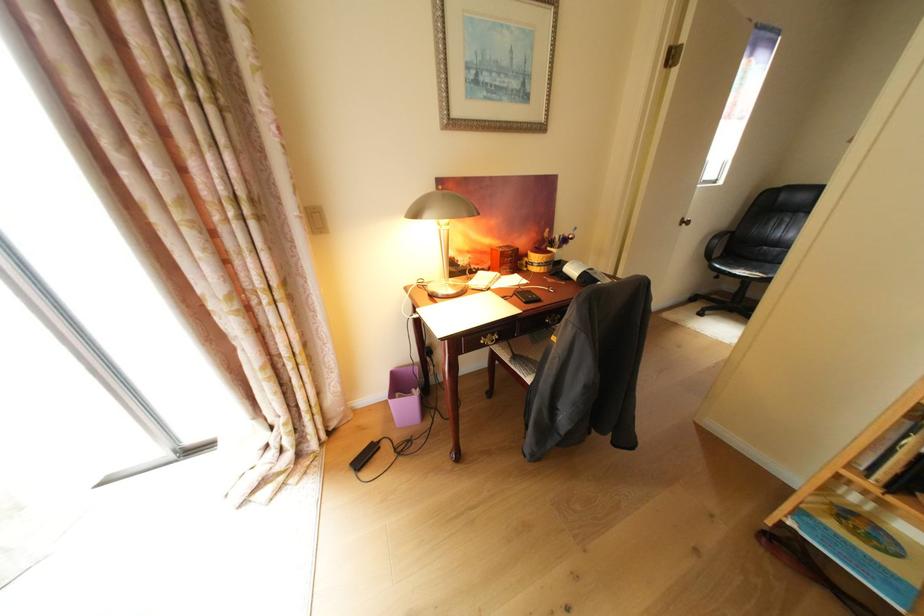
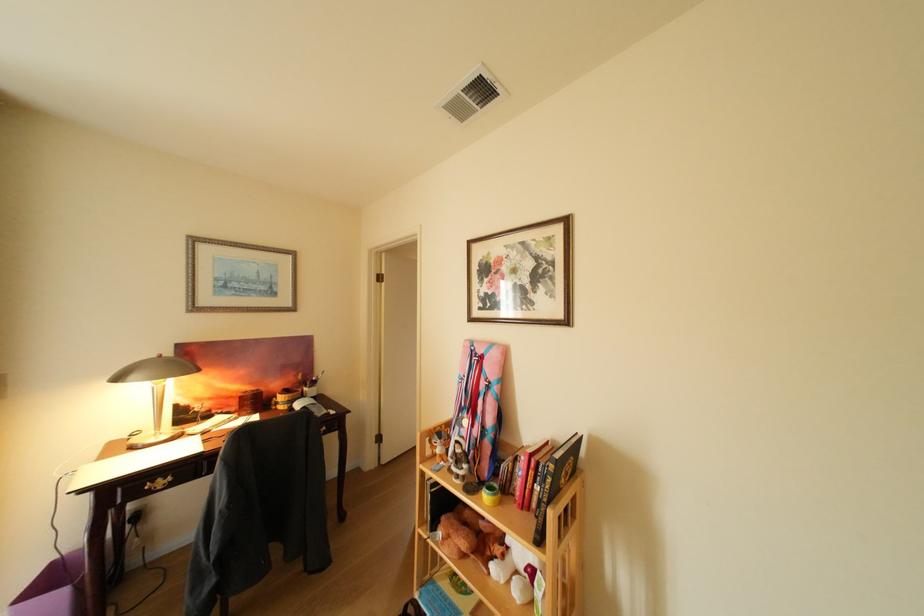
Find the pixel in the second image that matches [502,244] in the first image.

(251, 389)